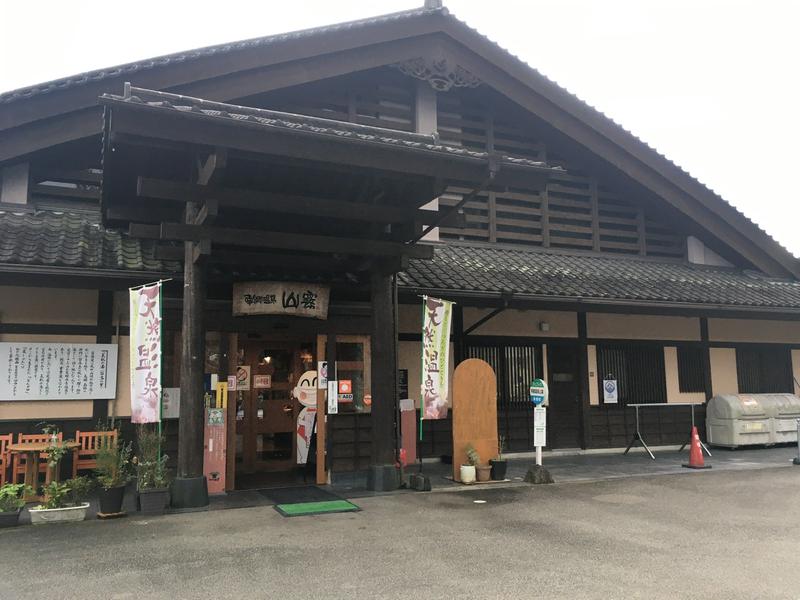
At what (x,y) coordinates should I click in order to perform the action: click on green mat. Please return your answer as a coordinate pair (x, y). This screenshot has height=600, width=800. Looking at the image, I should click on pos(306,507).